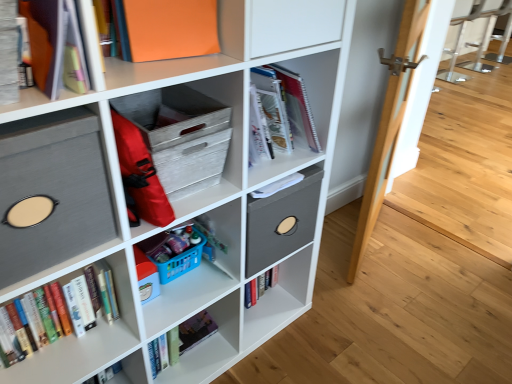
Question: Is hardcover books at left located within gray fabric storage bin at left, placed as the second shelf when sorted from bottom to top?

Choices:
 (A) yes
 (B) no

Answer: (B)

Question: Is gray fabric storage bin at left, which ranks as the third shelf in top-to-bottom order, to the left of hardcover books at left from the viewer's perspective?

Choices:
 (A) yes
 (B) no

Answer: (B)

Question: From the image's perspective, is gray fabric storage bin at left, placed as the second shelf when sorted from bottom to top, below hardcover books at left?

Choices:
 (A) yes
 (B) no

Answer: (B)

Question: Is gray fabric storage bin at left, which ranks as the third shelf in top-to-bottom order, thinner than hardcover books at left?

Choices:
 (A) no
 (B) yes

Answer: (A)

Question: From a real-world perspective, is gray fabric storage bin at left, which ranks as the third shelf in top-to-bottom order, over hardcover books at left?

Choices:
 (A) no
 (B) yes

Answer: (B)

Question: Is gray fabric storage bin at left, which ranks as the third shelf in top-to-bottom order, inside the boundaries of matte gray fabric storage cube at upper left, the fourth shelf in the top-to-bottom sequence, or outside?

Choices:
 (A) inside
 (B) outside

Answer: (A)

Question: Is gray fabric storage bin at left, placed as the second shelf when sorted from bottom to top, in front of or behind matte gray fabric storage cube at upper left, the fourth shelf in the top-to-bottom sequence, in the image?

Choices:
 (A) front
 (B) behind

Answer: (B)

Question: Looking at their shapes, would you say gray fabric storage bin at left, placed as the second shelf when sorted from bottom to top, is wider or thinner than matte gray fabric storage cube at upper left, arranged as the first shelf when ordered from the bottom?

Choices:
 (A) wide
 (B) thin

Answer: (B)

Question: From a real-world perspective, is gray fabric storage bin at left, which ranks as the third shelf in top-to-bottom order, above or below matte gray fabric storage cube at upper left, the fourth shelf in the top-to-bottom sequence?

Choices:
 (A) above
 (B) below

Answer: (A)

Question: Is orange matte paper at upper center taller or shorter than gray fabric storage bin at left, which ranks as the third shelf in top-to-bottom order?

Choices:
 (A) short
 (B) tall

Answer: (A)

Question: Based on their positions, is orange matte paper at upper center located to the left or right of gray fabric storage bin at left, which ranks as the third shelf in top-to-bottom order?

Choices:
 (A) right
 (B) left

Answer: (A)

Question: Looking at their shapes, would you say orange matte paper at upper center is wider or thinner than gray fabric storage bin at left, which ranks as the third shelf in top-to-bottom order?

Choices:
 (A) thin
 (B) wide

Answer: (A)

Question: Is orange matte paper at upper center inside or outside of gray fabric storage bin at left, placed as the second shelf when sorted from bottom to top?

Choices:
 (A) outside
 (B) inside

Answer: (A)

Question: From the image's perspective, is hardcover books at left above or below wooden crate at center, acting as the third shelf starting from the bottom?

Choices:
 (A) below
 (B) above

Answer: (A)

Question: In the image, is hardcover books at left on the left side or the right side of wooden crate at center, placed as the second shelf when sorted from top to bottom?

Choices:
 (A) left
 (B) right

Answer: (A)